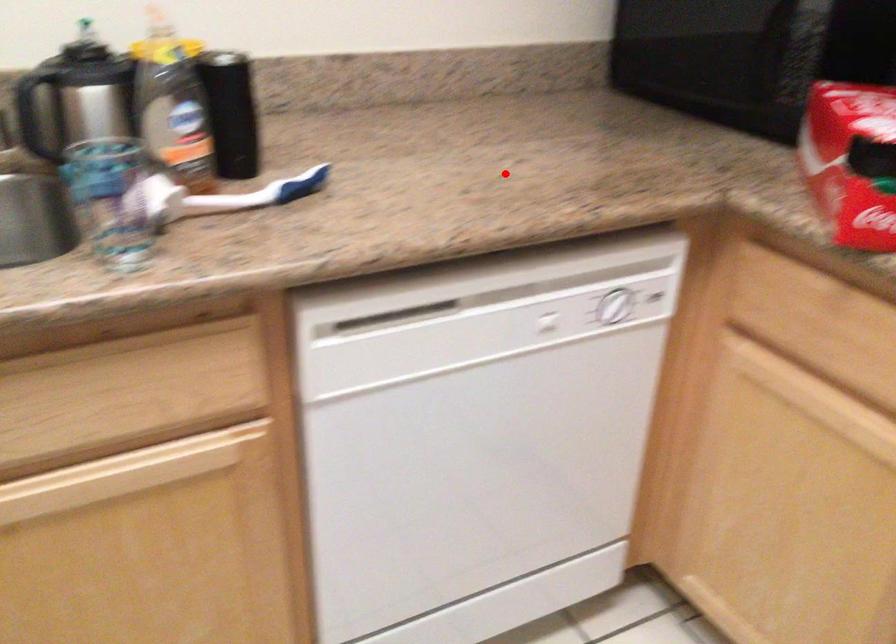
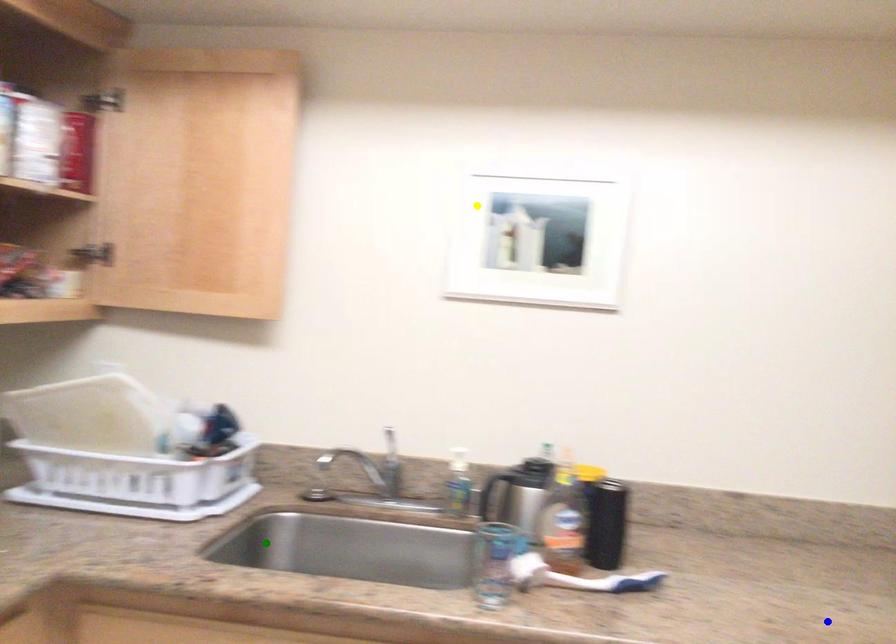
Question: I am providing you with two images of the same scene from different viewpoints. A red point is marked on the first image. You are given multiple points on the second image. Which mark in image 2 goes with the point in image 1?

Choices:
 (A) yellow point
 (B) green point
 (C) blue point

Answer: (C)